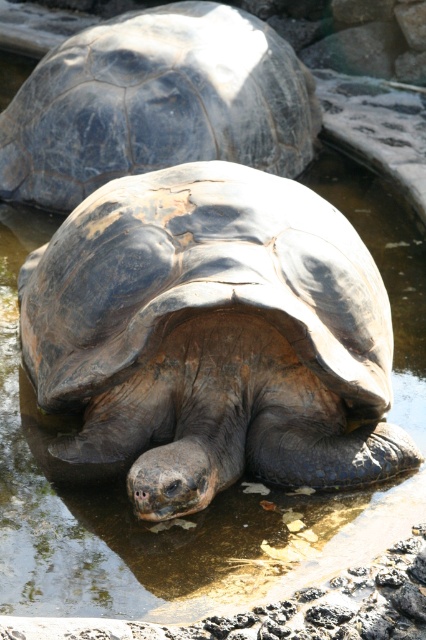
Question: Which point is closer to the camera?

Choices:
 (A) leathery brown tortoise at center
 (B) dark gray textured shell at center

Answer: (A)

Question: Can you confirm if leathery brown tortoise at center is bigger than dark gray textured shell at center?

Choices:
 (A) yes
 (B) no

Answer: (A)

Question: Which object appears farthest from the camera in this image?

Choices:
 (A) leathery brown tortoise at center
 (B) dark gray textured shell at center

Answer: (B)

Question: Can you confirm if leathery brown tortoise at center is bigger than dark gray textured shell at center?

Choices:
 (A) yes
 (B) no

Answer: (A)

Question: Observing the image, what is the correct spatial positioning of leathery brown tortoise at center in reference to dark gray textured shell at center?

Choices:
 (A) right
 (B) left

Answer: (A)